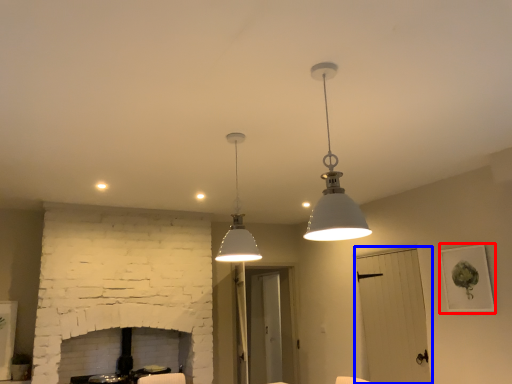
Question: Which object is further to the camera taking this photo, picture frame (highlighted by a red box) or glass door (highlighted by a blue box)?

Choices:
 (A) picture frame
 (B) glass door

Answer: (B)